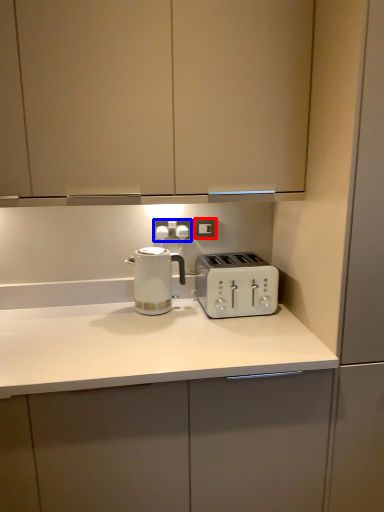
Question: Which point is further to the camera, electric outlet (highlighted by a red box) or electric outlet (highlighted by a blue box)?

Choices:
 (A) electric outlet
 (B) electric outlet

Answer: (A)